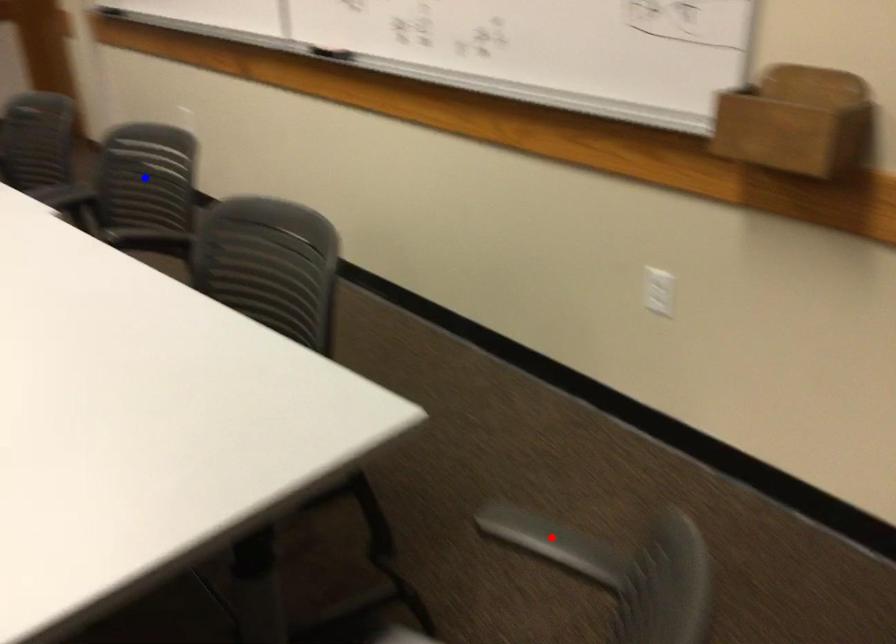
Question: Which of the two points in the image is closer to the camera?

Choices:
 (A) Blue point is closer.
 (B) Red point is closer.

Answer: (B)